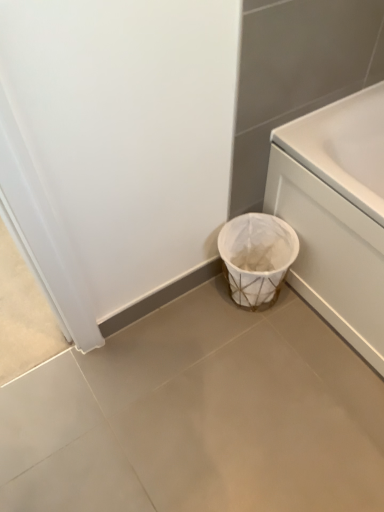
Locate an element on the screen. vacant space positioned to the left of white woven basket at lower center is located at coordinates (192, 315).